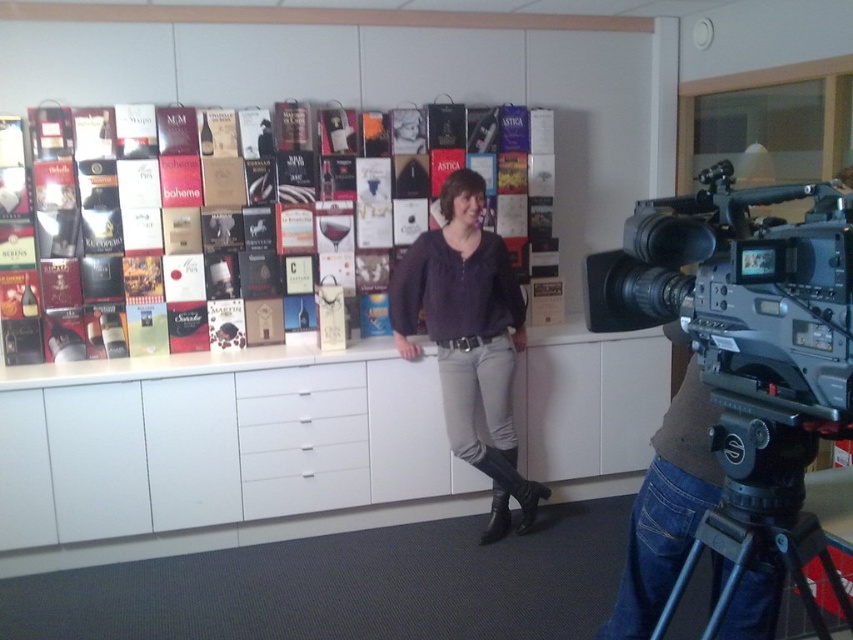
Which is in front, point (315, 497) or point (796, 520)?

Point (796, 520) is more forward.

Locate an element on the screen. The image size is (853, 640). white glossy drawer at center is located at coordinates (302, 440).

Does point (363, 390) come behind point (759, 538)?

Yes, it is.

At what (x,y) coordinates should I click in order to perform the action: click on white glossy drawer at center. Please return your answer as a coordinate pair (x, y). Image resolution: width=853 pixels, height=640 pixels. Looking at the image, I should click on (302, 440).

Is matte cardboard wine box at center wider than matte purple sweater at center?

Yes, matte cardboard wine box at center is wider than matte purple sweater at center.

Does point (109, 285) come in front of point (457, 177)?

No.

Measure the distance between matte cardboard wine box at center and camera.

3.23 meters

The height and width of the screenshot is (640, 853). I want to click on matte cardboard wine box at center, so click(125, 220).

Can you confirm if matte cardboard wine box at center is positioned to the right of silver metallic video camera at right?

Incorrect, matte cardboard wine box at center is not on the right side of silver metallic video camera at right.

Between point (84, 163) and point (743, 372), which one is positioned in front?

Point (743, 372) is in front.

What do you see at coordinates (125, 220) in the screenshot? I see `matte cardboard wine box at center` at bounding box center [125, 220].

This screenshot has width=853, height=640. I want to click on matte cardboard wine box at center, so click(125, 220).